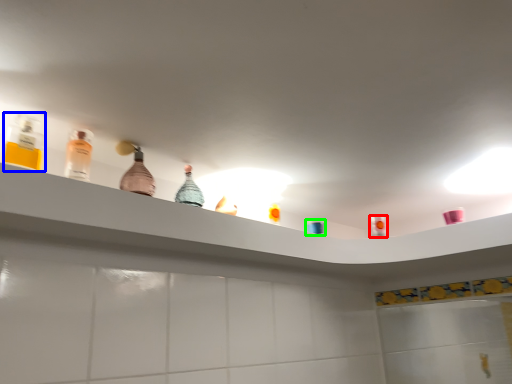
Question: Estimate the real-world distances between objects in this image. Which object is farther from mouthwash (highlighted by a red box), bottle (highlighted by a blue box) or toiletry (highlighted by a green box)?

Choices:
 (A) bottle
 (B) toiletry

Answer: (A)